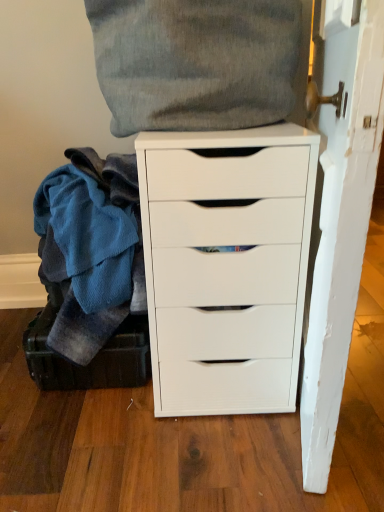
Identify the location of white matte chest of drawers at center. The height and width of the screenshot is (512, 384). (226, 266).

From the image's perspective, is dark green leather suitcase at lower left on top of blue fleece blanket at left, the second clothing in the top-to-bottom sequence?

Incorrect, from the image's perspective, dark green leather suitcase at lower left is lower than blue fleece blanket at left, the second clothing in the top-to-bottom sequence.

In the scene shown: Based on their sizes in the image, would you say dark green leather suitcase at lower left is bigger or smaller than blue fleece blanket at left, the first clothing from the bottom?

Considering their sizes, dark green leather suitcase at lower left takes up less space than blue fleece blanket at left, the first clothing from the bottom.

Does dark green leather suitcase at lower left have a lesser height compared to blue fleece blanket at left, the first clothing from the bottom?

Indeed, dark green leather suitcase at lower left has a lesser height compared to blue fleece blanket at left, the first clothing from the bottom.

Is dark green leather suitcase at lower left wider than blue fleece blanket at left, the first clothing from the bottom?

No.

From a real-world perspective, which is physically above, soft gray fabric pillow at upper center, the 2th clothing positioned from the bottom, or dark green leather suitcase at lower left?

soft gray fabric pillow at upper center, the 2th clothing positioned from the bottom, from a real-world perspective.

Would you say soft gray fabric pillow at upper center, the 2th clothing positioned from the bottom, contains dark green leather suitcase at lower left?

No, dark green leather suitcase at lower left is not a part of soft gray fabric pillow at upper center, the 2th clothing positioned from the bottom.

You are a GUI agent. You are given a task and a screenshot of the screen. Output one action in this format:
    pyautogui.click(x=<x>, y=<y>)
    Task: Click on the luggage below the soft gray fabric pillow at upper center, the first clothing when ordered from top to bottom (from a real-world perspective)
    The height and width of the screenshot is (512, 384).
    Given the screenshot: What is the action you would take?
    tap(92, 360)

Can you see soft gray fabric pillow at upper center, the 2th clothing positioned from the bottom, touching dark green leather suitcase at lower left?

No, soft gray fabric pillow at upper center, the 2th clothing positioned from the bottom, is not beside dark green leather suitcase at lower left.

At what (x,y) coordinates should I click in order to perform the action: click on luggage below the white matte chest of drawers at center (from the image's perspective). Please return your answer as a coordinate pair (x, y). The height and width of the screenshot is (512, 384). Looking at the image, I should click on (92, 360).

Looking at this image, which is more to the left, white matte chest of drawers at center or dark green leather suitcase at lower left?

dark green leather suitcase at lower left is more to the left.

Consider the image. From the image's perspective, relative to dark green leather suitcase at lower left, is white matte chest of drawers at center above or below?

white matte chest of drawers at center is above dark green leather suitcase at lower left.

Is white matte chest of drawers at center next to dark green leather suitcase at lower left?

white matte chest of drawers at center and dark green leather suitcase at lower left are not in contact.

How far apart are soft gray fabric pillow at upper center, the first clothing when ordered from top to bottom, and blue fleece blanket at left, the second clothing in the top-to-bottom sequence?

A distance of 32.97 centimeters exists between soft gray fabric pillow at upper center, the first clothing when ordered from top to bottom, and blue fleece blanket at left, the second clothing in the top-to-bottom sequence.

Considering the sizes of objects soft gray fabric pillow at upper center, the first clothing when ordered from top to bottom, and blue fleece blanket at left, the second clothing in the top-to-bottom sequence, in the image provided, who is thinner, soft gray fabric pillow at upper center, the first clothing when ordered from top to bottom, or blue fleece blanket at left, the second clothing in the top-to-bottom sequence,?

soft gray fabric pillow at upper center, the first clothing when ordered from top to bottom.

Consider the image. Is soft gray fabric pillow at upper center, the 2th clothing positioned from the bottom, outside of blue fleece blanket at left, the second clothing in the top-to-bottom sequence?

Yes, soft gray fabric pillow at upper center, the 2th clothing positioned from the bottom, is located beyond the bounds of blue fleece blanket at left, the second clothing in the top-to-bottom sequence.

Is soft gray fabric pillow at upper center, the first clothing when ordered from top to bottom, facing away from blue fleece blanket at left, the second clothing in the top-to-bottom sequence?

No, soft gray fabric pillow at upper center, the first clothing when ordered from top to bottom,'s orientation is not away from blue fleece blanket at left, the second clothing in the top-to-bottom sequence.

Is dark green leather suitcase at lower left at the right side of soft gray fabric pillow at upper center, the first clothing when ordered from top to bottom?

Incorrect, dark green leather suitcase at lower left is not on the right side of soft gray fabric pillow at upper center, the first clothing when ordered from top to bottom.

Between dark green leather suitcase at lower left and soft gray fabric pillow at upper center, the first clothing when ordered from top to bottom, which one has smaller width?

Thinner between the two is soft gray fabric pillow at upper center, the first clothing when ordered from top to bottom.

How different are the orientations of dark green leather suitcase at lower left and soft gray fabric pillow at upper center, the 2th clothing positioned from the bottom, in degrees?

There is a 30.4-degree angle between the facing directions of dark green leather suitcase at lower left and soft gray fabric pillow at upper center, the 2th clothing positioned from the bottom.

From the image's perspective, starting from the dark green leather suitcase at lower left, which clothing is the 2nd one above? Please provide its 2D coordinates.

[(197, 62)]

Does white matte chest of drawers at center have a greater height compared to soft gray fabric pillow at upper center, the first clothing when ordered from top to bottom?

Yes.

From the image's perspective, count 2nd clothings upward from the white matte chest of drawers at center and point to it. Please provide its 2D coordinates.

[(197, 62)]

Considering the sizes of objects white matte chest of drawers at center and soft gray fabric pillow at upper center, the first clothing when ordered from top to bottom, in the image provided, who is wider, white matte chest of drawers at center or soft gray fabric pillow at upper center, the first clothing when ordered from top to bottom,?

With larger width is white matte chest of drawers at center.

From the image's perspective, is blue fleece blanket at left, the second clothing in the top-to-bottom sequence, over dark green leather suitcase at lower left?

Yes, from the image's perspective, blue fleece blanket at left, the second clothing in the top-to-bottom sequence, is on top of dark green leather suitcase at lower left.

Would you say blue fleece blanket at left, the first clothing from the bottom, is to the left or to the right of dark green leather suitcase at lower left in the picture?

Based on their positions, blue fleece blanket at left, the first clothing from the bottom, is located to the left of dark green leather suitcase at lower left.

Does point (56, 293) lie behind point (120, 335)?

Yes, it is behind point (120, 335).

Is blue fleece blanket at left, the first clothing from the bottom, not close to dark green leather suitcase at lower left?

No, there isn't a large distance between blue fleece blanket at left, the first clothing from the bottom, and dark green leather suitcase at lower left.

Identify the location of the 1st clothing in front of the dark green leather suitcase at lower left, starting your count from the anchor. (99, 307).

This screenshot has width=384, height=512. Find the location of `luggage on the left of soft gray fabric pillow at upper center, the 2th clothing positioned from the bottom`. luggage on the left of soft gray fabric pillow at upper center, the 2th clothing positioned from the bottom is located at coordinates (92, 360).

When comparing their distances from soft gray fabric pillow at upper center, the first clothing when ordered from top to bottom, does white matte chest of drawers at center or blue fleece blanket at left, the second clothing in the top-to-bottom sequence, seem further?

The object further to soft gray fabric pillow at upper center, the first clothing when ordered from top to bottom, is blue fleece blanket at left, the second clothing in the top-to-bottom sequence.

From the image, which object appears to be nearer to dark green leather suitcase at lower left, blue fleece blanket at left, the second clothing in the top-to-bottom sequence, or soft gray fabric pillow at upper center, the 2th clothing positioned from the bottom?

Among the two, blue fleece blanket at left, the second clothing in the top-to-bottom sequence, is located nearer to dark green leather suitcase at lower left.

When comparing their distances from dark green leather suitcase at lower left, does soft gray fabric pillow at upper center, the 2th clothing positioned from the bottom, or white matte chest of drawers at center seem closer?

Among the two, white matte chest of drawers at center is located nearer to dark green leather suitcase at lower left.

Based on their spatial positions, is soft gray fabric pillow at upper center, the first clothing when ordered from top to bottom, or blue fleece blanket at left, the second clothing in the top-to-bottom sequence, closer to dark green leather suitcase at lower left?

blue fleece blanket at left, the second clothing in the top-to-bottom sequence, is closer to dark green leather suitcase at lower left.

Considering their positions, is blue fleece blanket at left, the first clothing from the bottom, positioned further to soft gray fabric pillow at upper center, the 2th clothing positioned from the bottom, than white matte chest of drawers at center?

Based on the image, blue fleece blanket at left, the first clothing from the bottom, appears to be further to soft gray fabric pillow at upper center, the 2th clothing positioned from the bottom.

When comparing their distances from blue fleece blanket at left, the first clothing from the bottom, does dark green leather suitcase at lower left or soft gray fabric pillow at upper center, the first clothing when ordered from top to bottom, seem further?

soft gray fabric pillow at upper center, the first clothing when ordered from top to bottom.

From the image, which object appears to be farther from dark green leather suitcase at lower left, white matte chest of drawers at center or blue fleece blanket at left, the second clothing in the top-to-bottom sequence?

white matte chest of drawers at center is positioned further to the anchor dark green leather suitcase at lower left.

Which object lies further to the anchor point blue fleece blanket at left, the first clothing from the bottom, white matte chest of drawers at center or dark green leather suitcase at lower left?

Based on the image, white matte chest of drawers at center appears to be further to blue fleece blanket at left, the first clothing from the bottom.

What are the coordinates of `clothing that lies between soft gray fabric pillow at upper center, the first clothing when ordered from top to bottom, and white matte chest of drawers at center from top to bottom` in the screenshot? It's located at (99, 307).

Where is `luggage between blue fleece blanket at left, the second clothing in the top-to-bottom sequence, and white matte chest of drawers at center`? luggage between blue fleece blanket at left, the second clothing in the top-to-bottom sequence, and white matte chest of drawers at center is located at coordinates (92, 360).

At what (x,y) coordinates should I click in order to perform the action: click on the chest of drawers that lies between soft gray fabric pillow at upper center, the 2th clothing positioned from the bottom, and dark green leather suitcase at lower left from top to bottom. Please return your answer as a coordinate pair (x, y). Looking at the image, I should click on (226, 266).

Image resolution: width=384 pixels, height=512 pixels. Identify the location of clothing that lies between soft gray fabric pillow at upper center, the 2th clothing positioned from the bottom, and dark green leather suitcase at lower left from top to bottom. (99, 307).